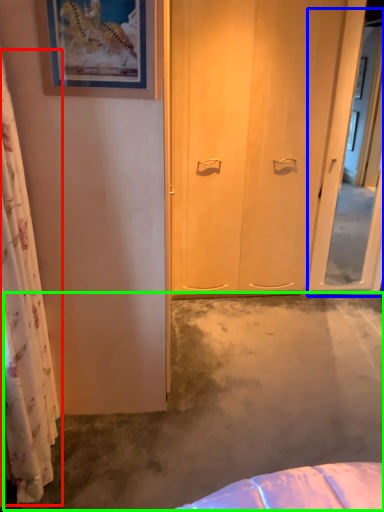
Question: Which is nearer to the curtain (highlighted by a red box)? screen door (highlighted by a blue box) or concrete (highlighted by a green box).

Choices:
 (A) screen door
 (B) concrete

Answer: (B)